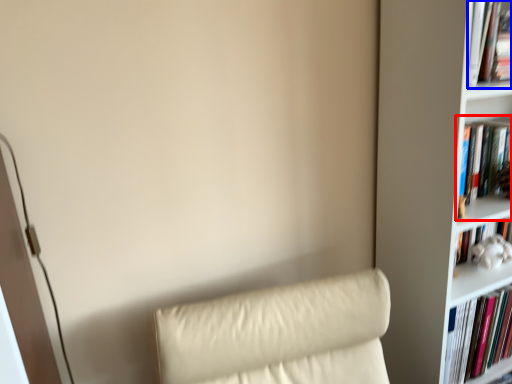
Question: Which point is closer to the camera, book (highlighted by a red box) or book (highlighted by a blue box)?

Choices:
 (A) book
 (B) book

Answer: (B)